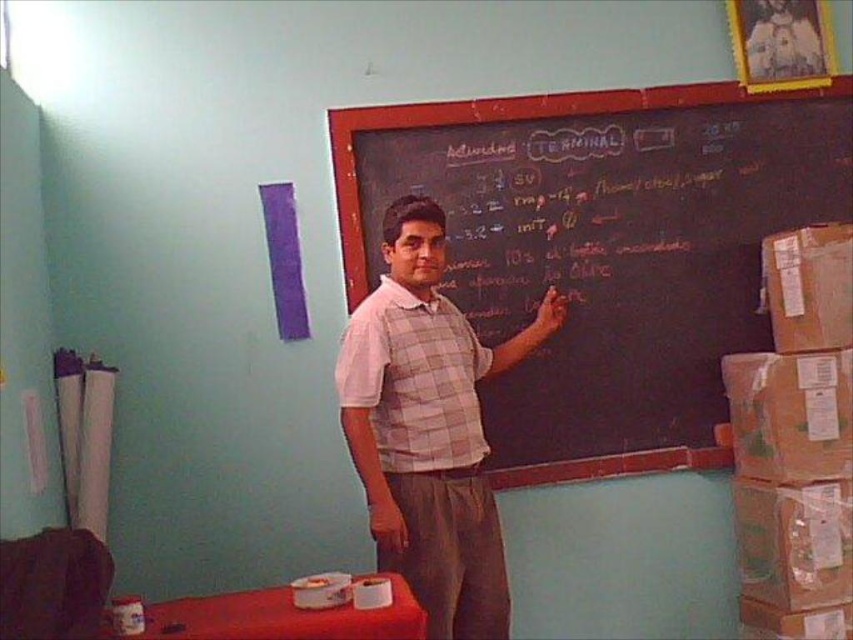
Question: Is black chalkboard at upper center bigger than plaid fabric vest at center?

Choices:
 (A) yes
 (B) no

Answer: (A)

Question: Does black chalkboard at upper center have a greater width compared to plaid fabric vest at center?

Choices:
 (A) yes
 (B) no

Answer: (A)

Question: Is black chalkboard at upper center bigger than plaid fabric vest at center?

Choices:
 (A) yes
 (B) no

Answer: (A)

Question: Among these objects, which one is nearest to the camera?

Choices:
 (A) black chalkboard at upper center
 (B) plaid fabric vest at center

Answer: (B)

Question: Among these objects, which one is nearest to the camera?

Choices:
 (A) plaid fabric vest at center
 (B) black chalkboard at upper center

Answer: (A)

Question: Which object is farther from the camera taking this photo?

Choices:
 (A) black chalkboard at upper center
 (B) plaid fabric vest at center

Answer: (A)